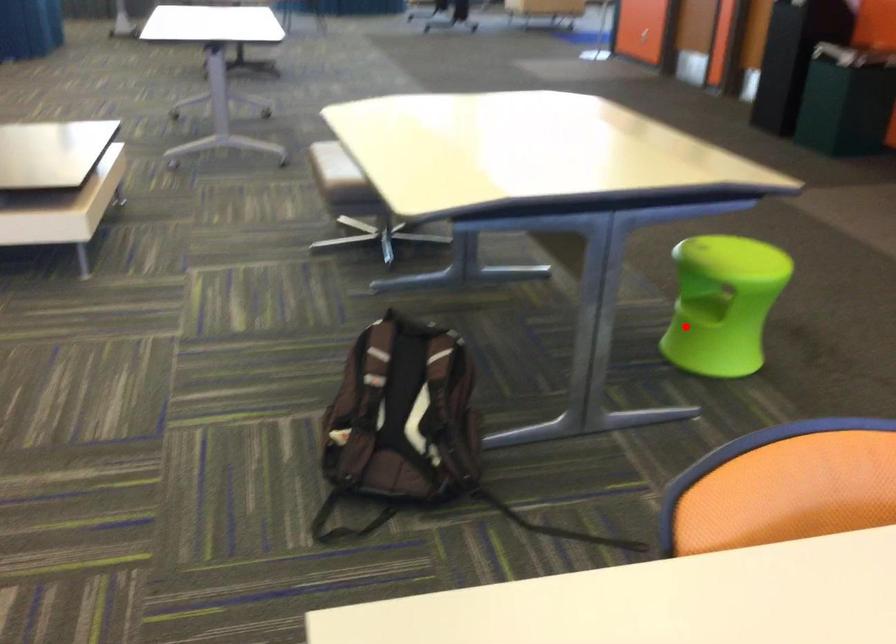
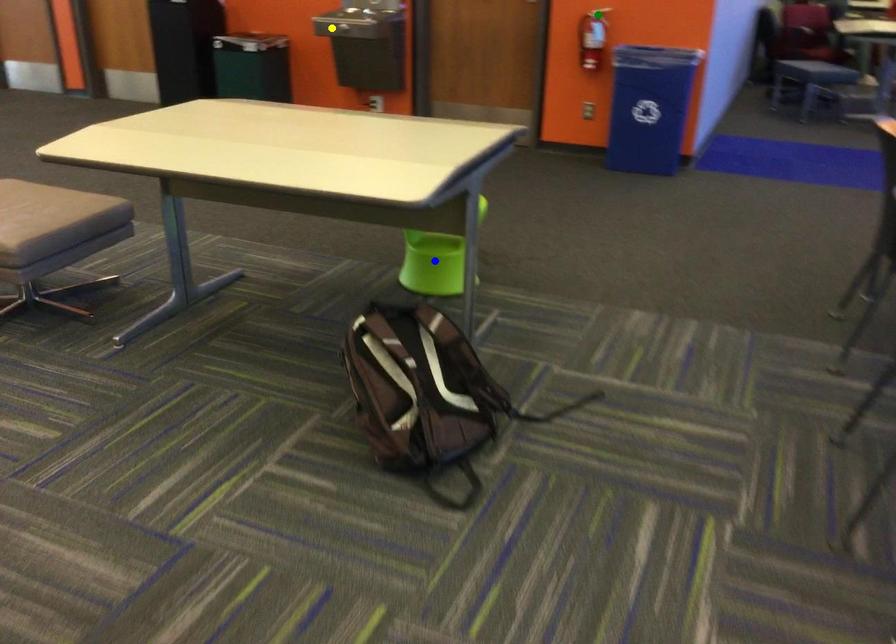
Question: I am providing you with two images of the same scene from different viewpoints. A red point is marked on the first image. You are given multiple points on the second image. Which point in image 2 represents the same 3d spot as the red point in image 1?

Choices:
 (A) yellow point
 (B) blue point
 (C) green point

Answer: (B)